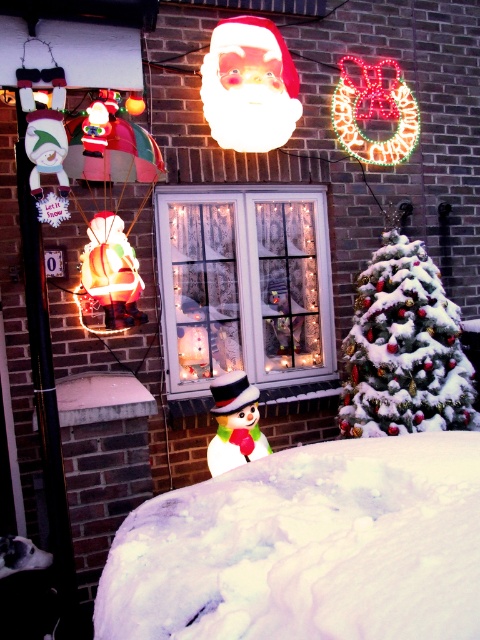
Is point (131, 561) in front of point (425, 259)?

That is True.

Locate an element on the screen. Image resolution: width=480 pixels, height=640 pixels. white fluffy snowman at lower center is located at coordinates (307, 547).

The height and width of the screenshot is (640, 480). Identify the location of white fluffy snowman at lower center. (307, 547).

Is point (455, 410) positioned after point (243, 372)?

Yes, point (455, 410) is farther from viewer.

Who is positioned more to the right, snow-covered green christmas tree at right or white glossy snowman at lower center?

snow-covered green christmas tree at right

Is point (356, 332) in front of point (222, 428)?

No.

This screenshot has height=640, width=480. Find the location of `snow-covered green christmas tree at right`. snow-covered green christmas tree at right is located at coordinates (404, 348).

Between white frosted glass window at center and snow-covered green christmas tree at right, which one has less height?

Standing shorter between the two is snow-covered green christmas tree at right.

Does point (242, 268) come farther from viewer compared to point (346, 365)?

Yes.

Who is more distant from viewer, [287,228] or [441,324]?

Point [287,228]

Find the location of `white frosted glass window at center`. white frosted glass window at center is located at coordinates (243, 285).